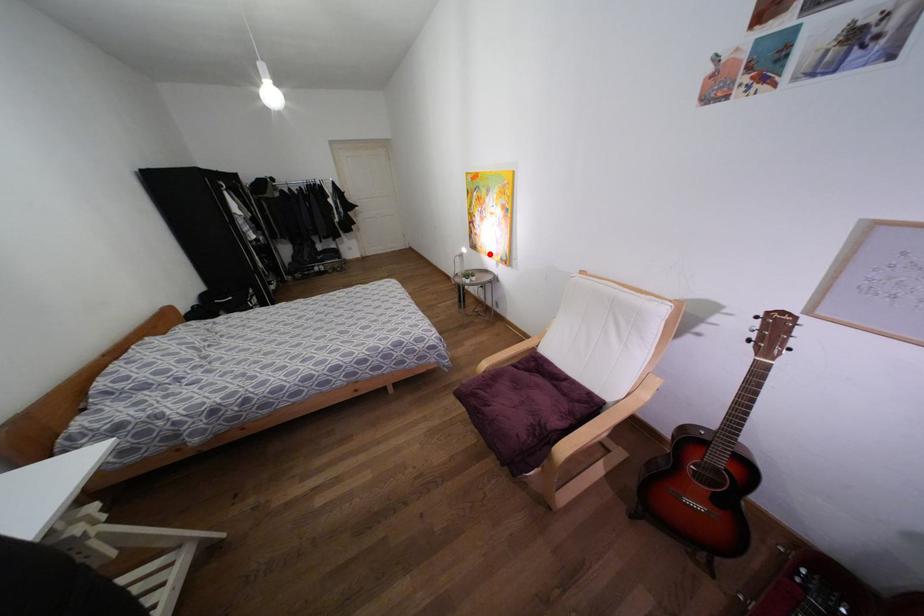
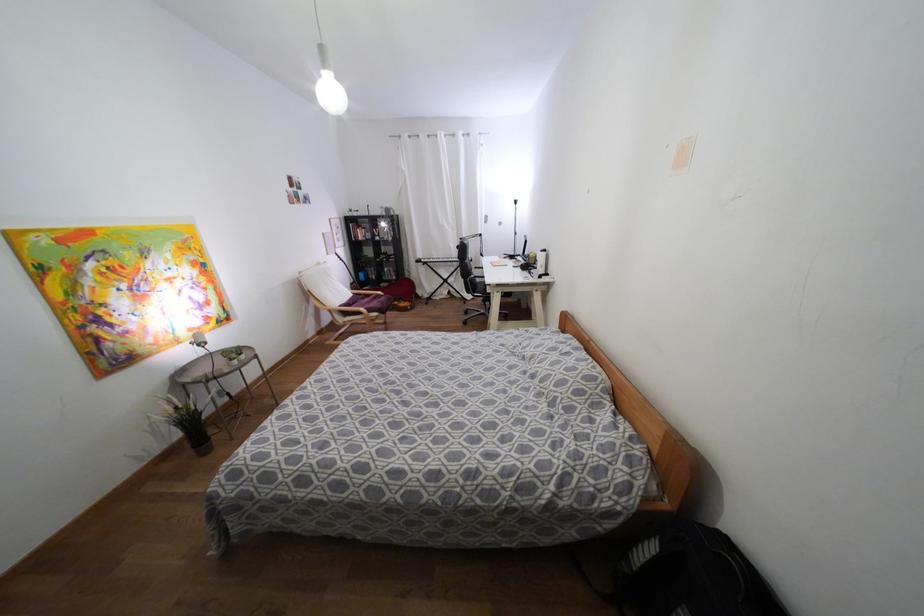
Question: I am providing you with two images of the same scene from different viewpoints. Image1 has a red point marked. In image2, the corresponding 3D location appears at what relative position? Reply with the corresponding letter.

Choices:
 (A) Closer
 (B) Farther

Answer: (B)